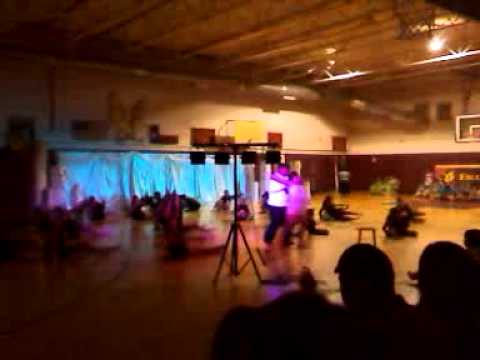
You are a GUI agent. You are given a task and a screenshot of the screen. Output one action in this format:
    pyautogui.click(x=<x>, y=<y>)
    Task: Click on the light stand leg
    
    Given the screenshot: What is the action you would take?
    pyautogui.click(x=218, y=273), pyautogui.click(x=232, y=268), pyautogui.click(x=254, y=264)